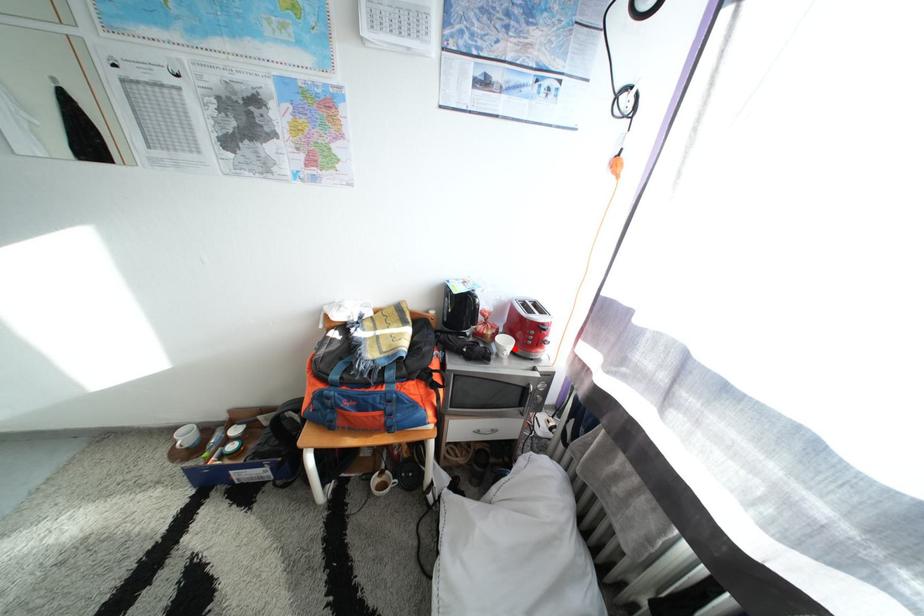
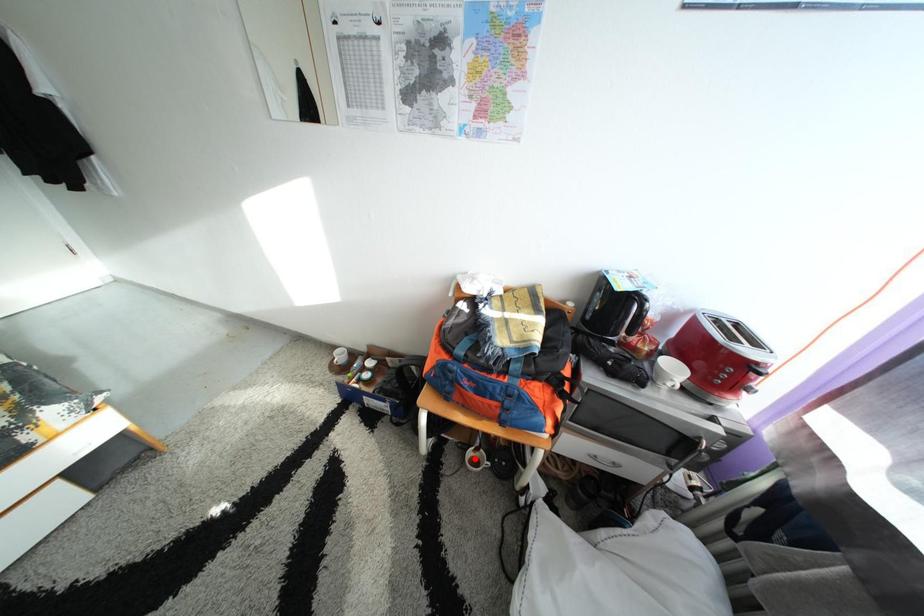
Looking at this image, I am providing you with two images of the same scene from different viewpoints. A red point is marked on the first image and another point is marked on the second image. Are the points marked in image1 and image2 representing the same 3D position?

No